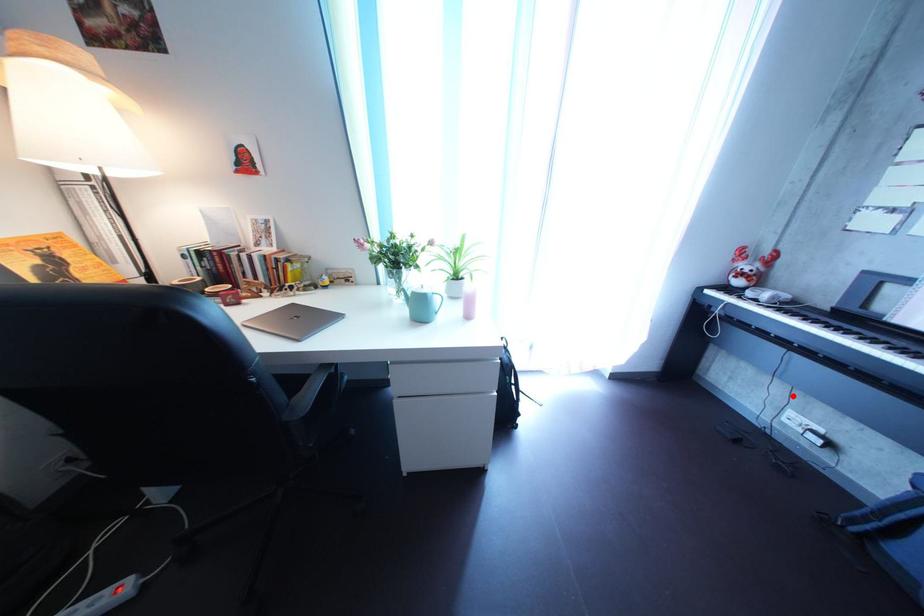
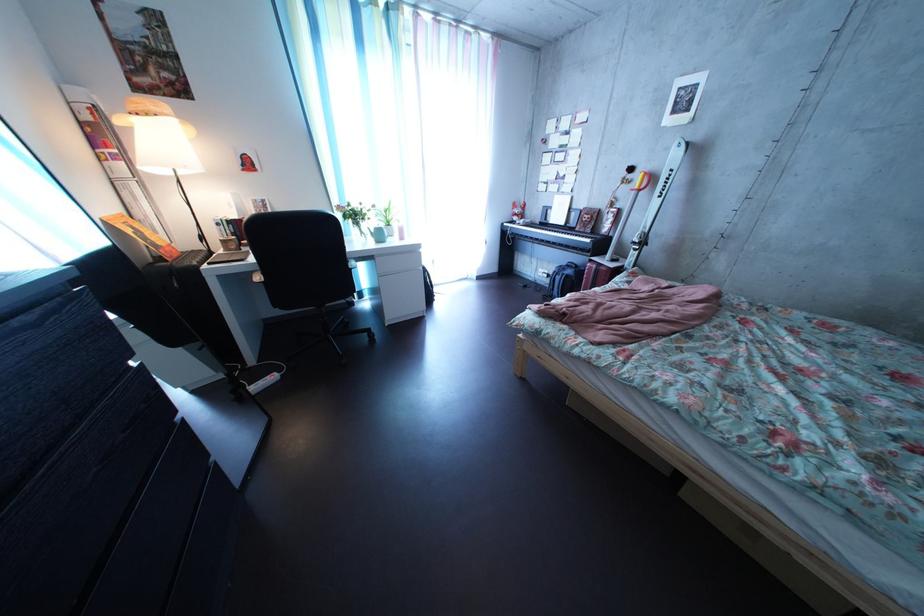
Question: A red point is marked in image1. In image2, is the corresponding 3D point closer to the camera or farther? Reply with the corresponding letter.

Choices:
 (A) The corresponding 3D point is closer.
 (B) The corresponding 3D point is farther.

Answer: (A)